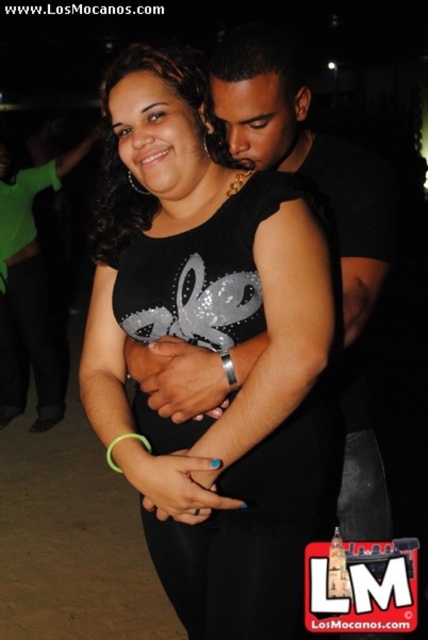
Question: Which point appears closest to the camera in this image?

Choices:
 (A) (0, 365)
 (B) (166, 161)

Answer: (B)

Question: Which object is the farthest from the black sequined dress at center?

Choices:
 (A) green matte shirt at left
 (B) black matte shirt at upper right

Answer: (A)

Question: Based on their relative distances, which object is nearer to the green matte shirt at left?

Choices:
 (A) black matte shirt at upper right
 (B) black sequined dress at center

Answer: (B)

Question: Does black sequined dress at center have a larger size compared to black matte shirt at upper right?

Choices:
 (A) yes
 (B) no

Answer: (A)

Question: Does black sequined dress at center have a greater width compared to green matte shirt at left?

Choices:
 (A) no
 (B) yes

Answer: (A)

Question: Does black sequined dress at center appear under green matte shirt at left?

Choices:
 (A) no
 (B) yes

Answer: (B)